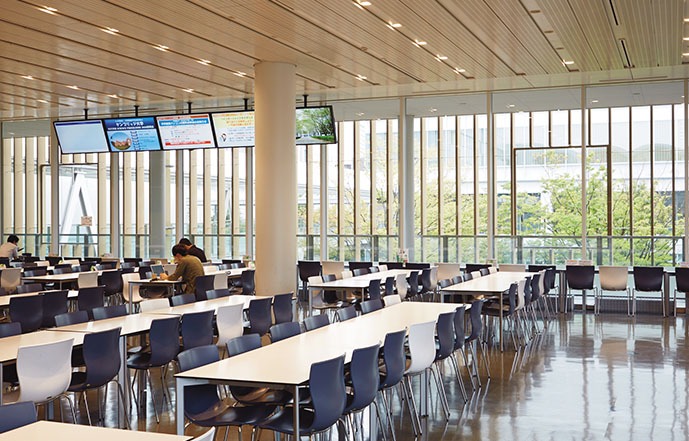
The image size is (689, 441). I want to click on television monitors, so click(309, 114), click(236, 122), click(200, 131), click(147, 137), click(92, 146).